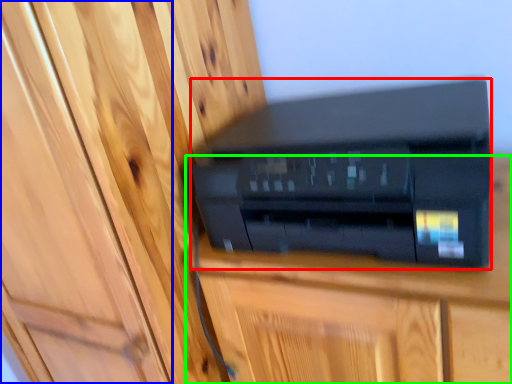
Question: Which is nearer to the printer (highlighted by a red box)? door (highlighted by a blue box) or furniture (highlighted by a green box).

Choices:
 (A) door
 (B) furniture

Answer: (B)